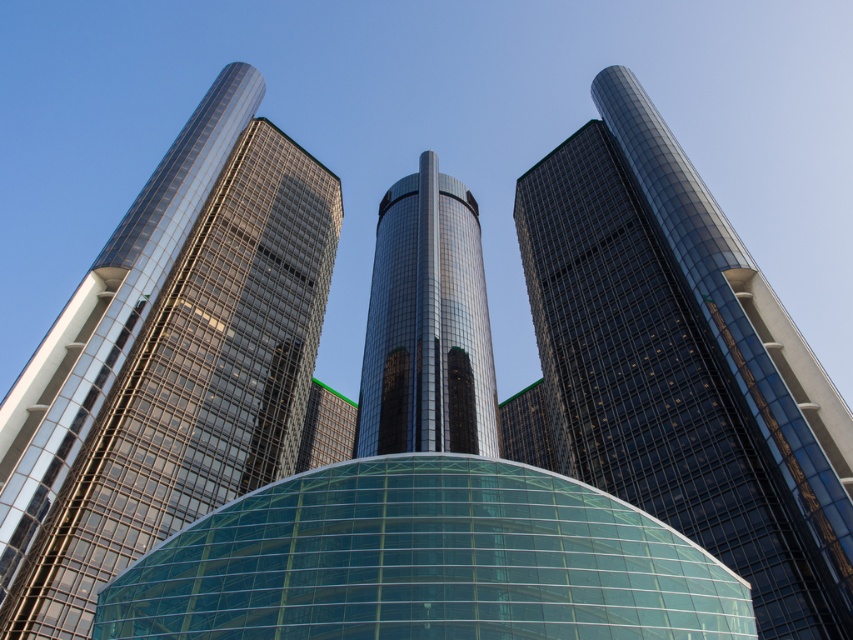
Which is more to the left, glossy glass skyscraper at center or glossy glass tower at center?

From the viewer's perspective, glossy glass tower at center appears more on the left side.

Between glossy glass skyscraper at center and glossy glass tower at center, which one has more height?

Standing taller between the two is glossy glass skyscraper at center.

Is point (672, 228) more distant than point (450, 349)?

No, it is not.

Locate an element on the screen. The height and width of the screenshot is (640, 853). glossy glass skyscraper at center is located at coordinates (682, 364).

Measure the distance from shiny glass skyscraper at center to glossy glass tower at center.

The distance of shiny glass skyscraper at center from glossy glass tower at center is 28.90 meters.

Can you confirm if shiny glass skyscraper at center is taller than glossy glass tower at center?

Yes, shiny glass skyscraper at center is taller than glossy glass tower at center.

Does point (305, 388) come farther from viewer compared to point (412, 403)?

That is True.

Locate an element on the screen. The width and height of the screenshot is (853, 640). shiny glass skyscraper at center is located at coordinates (170, 362).

Does shiny glass skyscraper at center have a lesser height compared to glossy glass skyscraper at center?

Incorrect, shiny glass skyscraper at center's height does not fall short of glossy glass skyscraper at center's.

Is shiny glass skyscraper at center taller than glossy glass skyscraper at center?

Yes.

Is point (184, 490) farther from viewer compared to point (830, 410)?

Yes.

The width and height of the screenshot is (853, 640). In order to click on shiny glass skyscraper at center in this screenshot , I will do `click(170, 362)`.